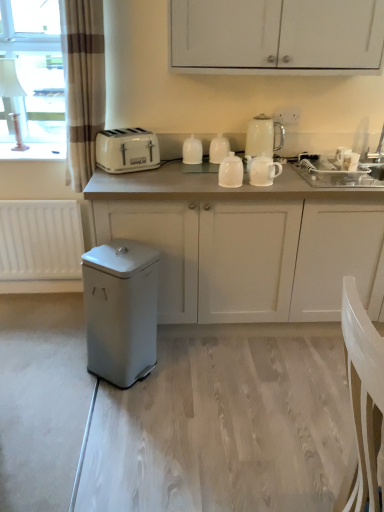
Question: Does brown striped curtain at left come in front of white glossy teapot at center, the 4th kitchen appliance in the left-to-right sequence?

Choices:
 (A) no
 (B) yes

Answer: (B)

Question: From a real-world perspective, is brown striped curtain at left under white glossy teapot at center, which is counted as the second kitchen appliance, starting from the right?

Choices:
 (A) no
 (B) yes

Answer: (A)

Question: Can you confirm if brown striped curtain at left is positioned to the left of white glossy teapot at center, the 4th kitchen appliance in the left-to-right sequence?

Choices:
 (A) yes
 (B) no

Answer: (A)

Question: Does brown striped curtain at left have a larger size compared to white glossy teapot at center, which is counted as the second kitchen appliance, starting from the right?

Choices:
 (A) yes
 (B) no

Answer: (A)

Question: Does brown striped curtain at left have a lesser width compared to white glossy teapot at center, which is counted as the second kitchen appliance, starting from the right?

Choices:
 (A) yes
 (B) no

Answer: (B)

Question: From a real-world perspective, is white matte cabinet at upper center, arranged as the 2th cabinetry when ordered from the bottom, physically located above or below white plastic toaster at upper center?

Choices:
 (A) below
 (B) above

Answer: (B)

Question: Is white matte cabinet at upper center, the first cabinetry positioned from the top, wider or thinner than white plastic toaster at upper center?

Choices:
 (A) wide
 (B) thin

Answer: (A)

Question: From the image's perspective, is white matte cabinet at upper center, arranged as the 2th cabinetry when ordered from the bottom, located above or below white plastic toaster at upper center?

Choices:
 (A) below
 (B) above

Answer: (B)

Question: Do you think white matte cabinet at upper center, arranged as the 2th cabinetry when ordered from the bottom, is within white plastic toaster at upper center, or outside of it?

Choices:
 (A) inside
 (B) outside

Answer: (B)

Question: Based on their sizes in the image, would you say white matte radiator at lower left is bigger or smaller than white glossy teapot at center, the third kitchen appliance in the right-to-left sequence?

Choices:
 (A) big
 (B) small

Answer: (A)

Question: Based on their positions, is white matte radiator at lower left located to the left or right of white glossy teapot at center, which is the third kitchen appliance in left-to-right order?

Choices:
 (A) left
 (B) right

Answer: (A)

Question: Considering the positions of white matte radiator at lower left and white glossy teapot at center, the third kitchen appliance in the right-to-left sequence, in the image, is white matte radiator at lower left wider or thinner than white glossy teapot at center, the third kitchen appliance in the right-to-left sequence,?

Choices:
 (A) thin
 (B) wide

Answer: (A)

Question: Do you think white matte radiator at lower left is within white glossy teapot at center, which is the third kitchen appliance in left-to-right order, or outside of it?

Choices:
 (A) inside
 (B) outside

Answer: (B)

Question: Considering the positions of white glossy teapot at center, which is counted as the second kitchen appliance, starting from the right, and white plastic toaster at upper center in the image, is white glossy teapot at center, which is counted as the second kitchen appliance, starting from the right, taller or shorter than white plastic toaster at upper center?

Choices:
 (A) short
 (B) tall

Answer: (A)

Question: In terms of width, does white glossy teapot at center, which is counted as the second kitchen appliance, starting from the right, look wider or thinner when compared to white plastic toaster at upper center?

Choices:
 (A) wide
 (B) thin

Answer: (B)